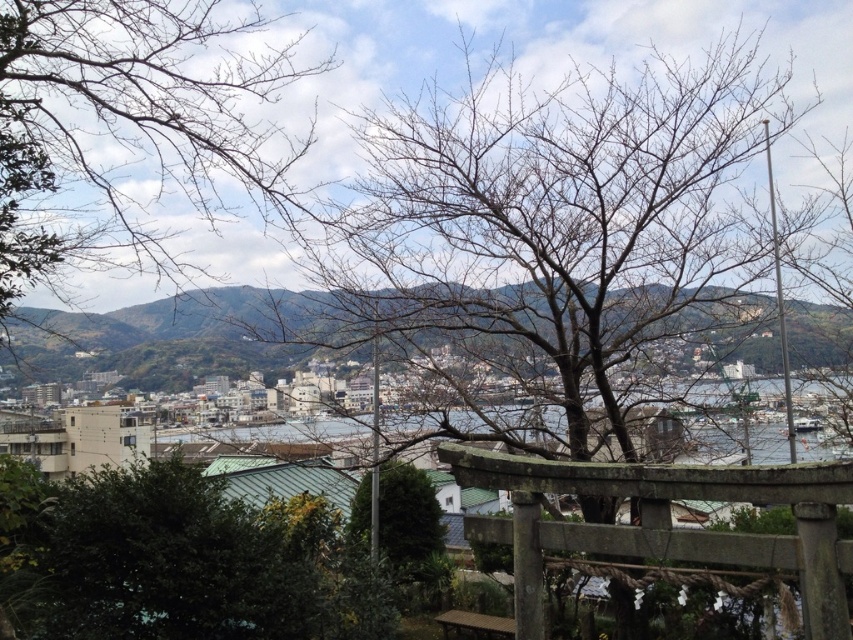
Question: Which point is closer to the camera taking this photo?

Choices:
 (A) (416, 538)
 (B) (154, 480)
 (C) (468, 316)

Answer: (B)

Question: Can you confirm if weathered wood torii gate at center is wider than green leafy tree at center?

Choices:
 (A) yes
 (B) no

Answer: (A)

Question: Can you confirm if green leafy bush at center is bigger than weathered wood torii gate at center?

Choices:
 (A) yes
 (B) no

Answer: (A)

Question: Which point is farther to the camera?

Choices:
 (A) green leafy bush at center
 (B) green leafy tree at center

Answer: (B)

Question: Which point appears closest to the camera in this image?

Choices:
 (A) (526, 593)
 (B) (843, 628)
 (C) (148, 118)

Answer: (B)

Question: Is bare branches at upper left above weathered wood torii gate at center?

Choices:
 (A) no
 (B) yes

Answer: (B)